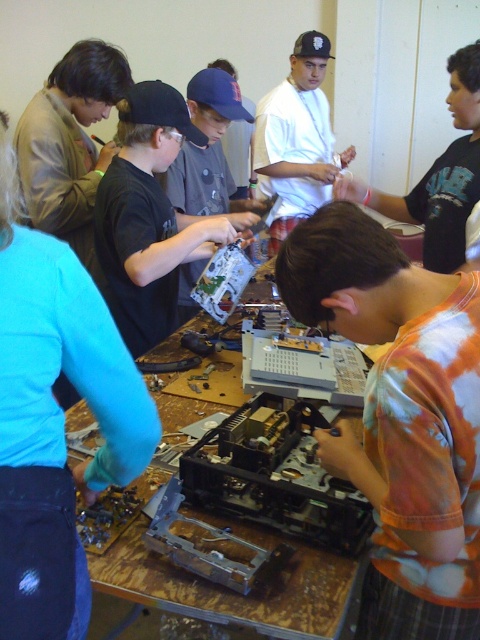
You are standing at the edge of the table in the image. You need to place a small tool exactly at the center of the table. The brushed metal circuit board at lower left is at coordinates point 0.658, 0.115. Can you determine if the tool placement will be near the circuit board?

The brushed metal circuit board at lower left is located at point (55, 420), so placing the tool at the center of the table would be away from the circuit board since the center coordinates would be different from the circuit board location.

You are a technician who needs to place the brushed metal circuit board at lower left onto the wooden table at center. Considering their sizes, will the circuit board fit on the table?

The brushed metal circuit board at lower left is much taller than the wooden table at center, so it will not fit on the table.

You are a technician who needs to place a camera on the wooden table at center. The camera requires a minimum of 36 inches of space from its current position to the table. Can you safely move the camera to the table?

The wooden table at center and camera are 35.73 inches apart. Since the required minimum space is 36 inches, the camera is too close to the table to safely move it there.